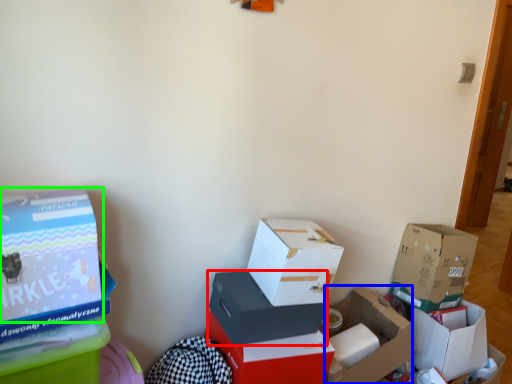
Question: Which object is positioned closest to box (highlighted by a red box)? Select from box (highlighted by a blue box) and box (highlighted by a green box).

Choices:
 (A) box
 (B) box

Answer: (A)